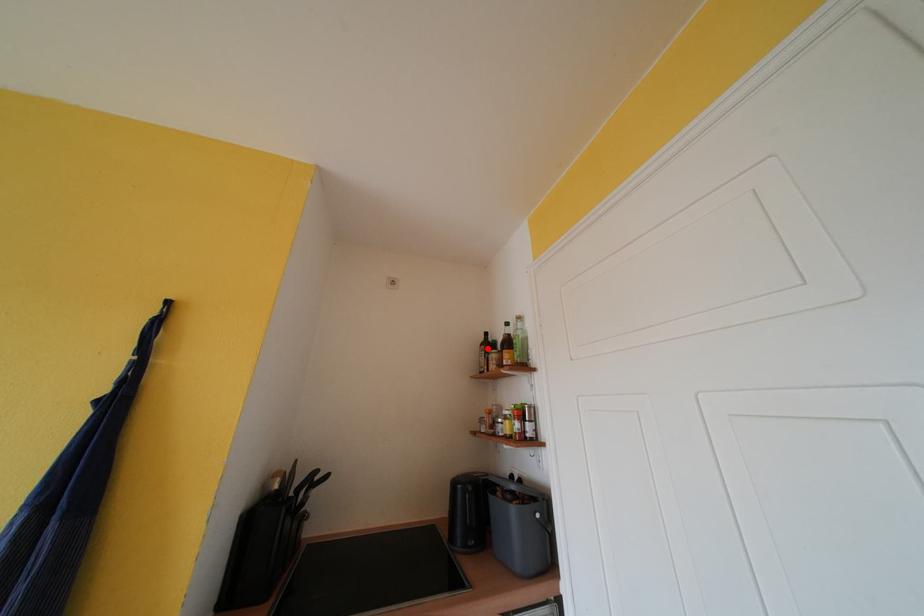
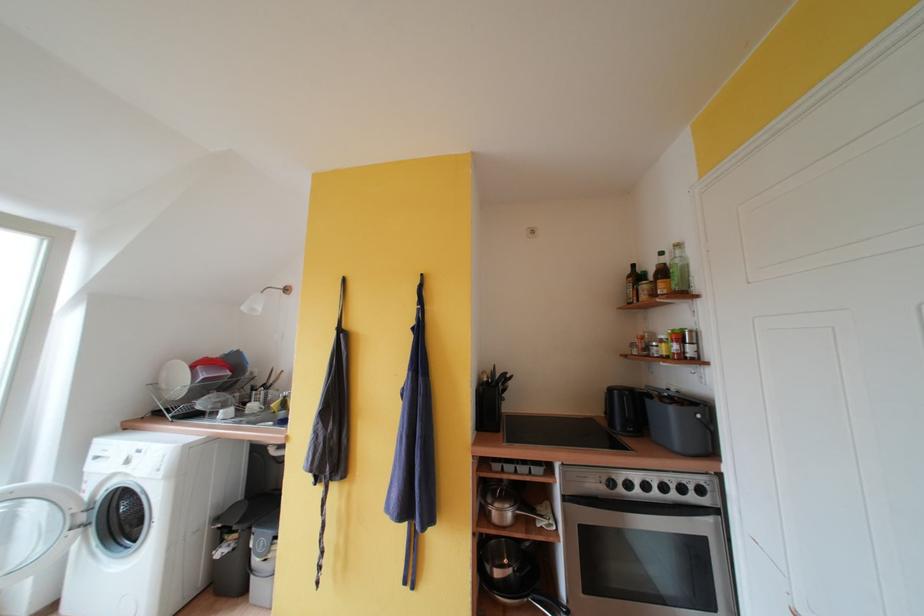
In the second image, find the point that corresponds to the highlighted location in the first image.

(634, 281)